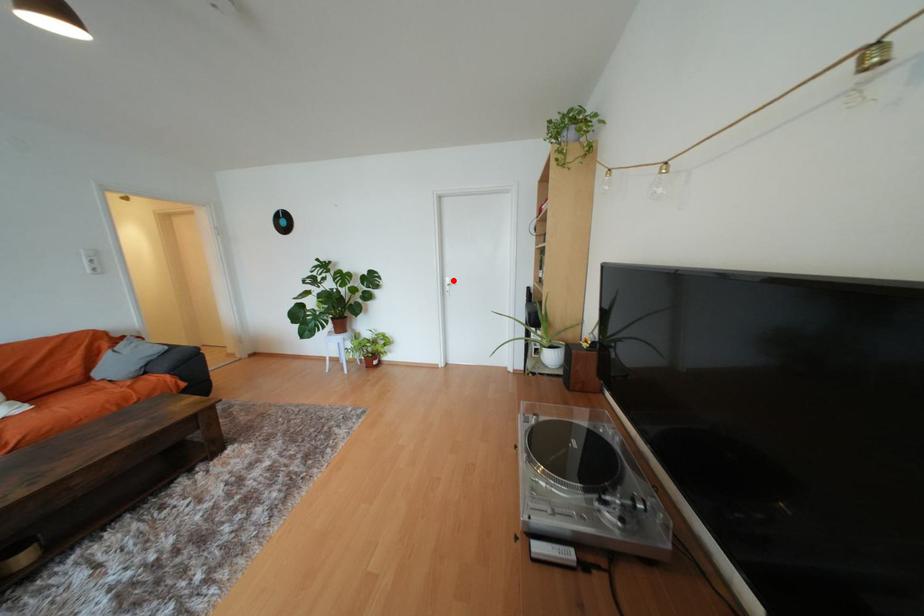
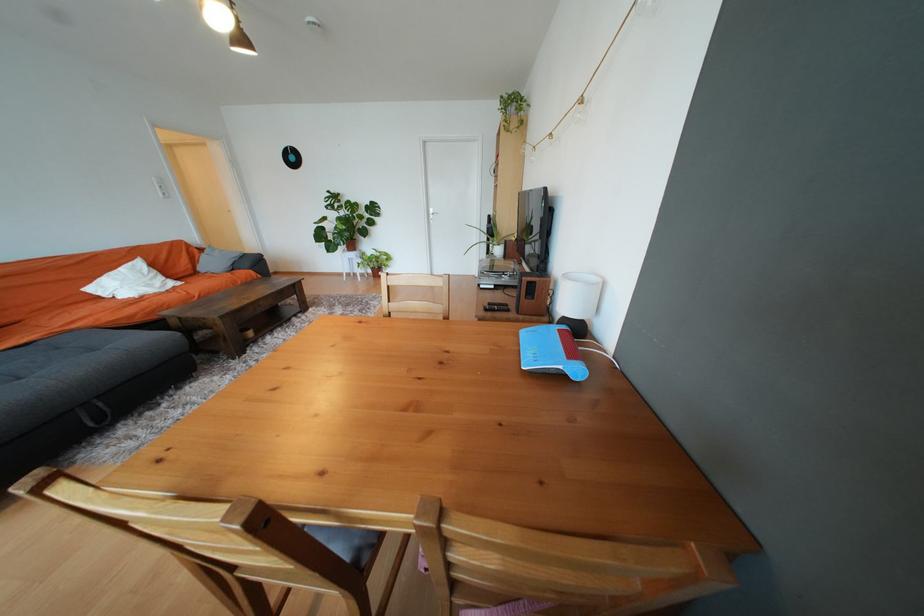
Find the pixel in the second image that matches the highlighted location in the first image.

(438, 211)